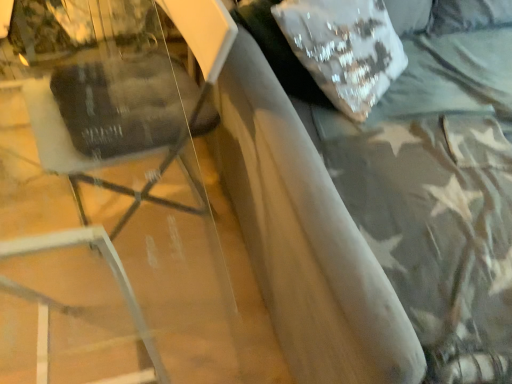
Question: Would you say white sequined pillow at upper right is to the left or to the right of suede-like gray bed at upper right in the picture?

Choices:
 (A) left
 (B) right

Answer: (A)

Question: From their relative heights in the image, would you say white sequined pillow at upper right is taller or shorter than suede-like gray bed at upper right?

Choices:
 (A) short
 (B) tall

Answer: (A)

Question: Estimate the real-world distances between objects in this image. Which object is closer to the white sequined pillow at upper right?

Choices:
 (A) matte black swivel chair at left
 (B) suede-like gray bed at upper right

Answer: (B)

Question: Which of these objects is positioned closest to the white sequined pillow at upper right?

Choices:
 (A) matte black swivel chair at left
 (B) suede-like gray bed at upper right

Answer: (B)